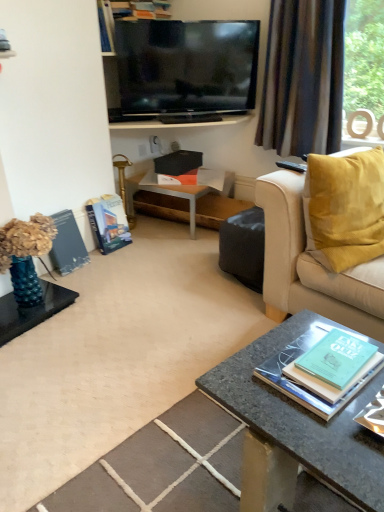
Question: Considering the relative positions of brown textured curtain at upper right and woodenwoodentable at center in the image provided, is brown textured curtain at upper right to the left or to the right of woodenwoodentable at center?

Choices:
 (A) left
 (B) right

Answer: (B)

Question: Is brown textured curtain at upper right taller or shorter than woodenwoodentable at center?

Choices:
 (A) tall
 (B) short

Answer: (A)

Question: Which of these objects is positioned closest to the hardcover book at upper center, arranged as the first book when viewed from the back?

Choices:
 (A) hardcover book at left, acting as the 2th magazine starting from the left
 (B) smooth stone coffee table at center
 (C) granite coffee table at lower center
 (D) beige fabric couch at right
 (E) woodenwoodentable at center

Answer: (E)

Question: Which of these objects is positioned closest to the brown textured curtain at upper right?

Choices:
 (A) orange matte magazine at center, the 3th magazine positioned from the left
 (B) beige fabric couch at right
 (C) hardcover book at upper center, arranged as the first book when viewed from the back
 (D) hardcover book at left, the second magazine when ordered from right to left
 (E) green matte book at lower right, the 2th book positioned from the top

Answer: (A)